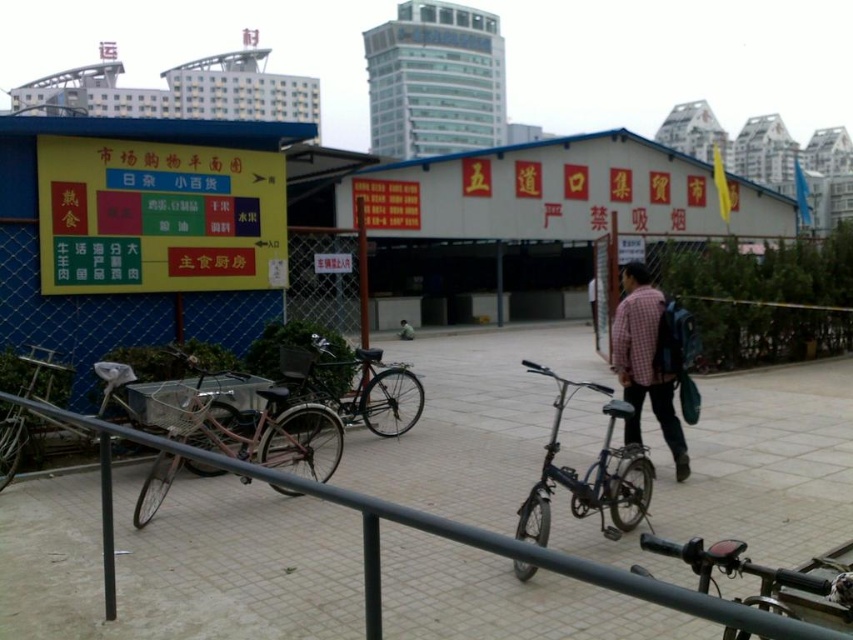
Question: Which is nearer to the plaid shirt at center?

Choices:
 (A) shiny black bicycle at center
 (B) pink matte bicycle at center-left
 (C) gray concrete pavement at center
 (D) blue metallic bicycle at center

Answer: (D)

Question: Can you confirm if gray concrete pavement at center is positioned below plaid shirt at center?

Choices:
 (A) yes
 (B) no

Answer: (A)

Question: Can you confirm if blue metallic bicycle at center is wider than shiny black bicycle at center?

Choices:
 (A) yes
 (B) no

Answer: (B)

Question: Does gray concrete pavement at center appear on the left side of plaid shirt at center?

Choices:
 (A) yes
 (B) no

Answer: (B)

Question: Which of the following is the farthest from the observer?

Choices:
 (A) (x=654, y=324)
 (B) (x=260, y=417)
 (C) (x=344, y=406)

Answer: (C)

Question: Which point is closer to the camera?

Choices:
 (A) blue metallic bicycle at center
 (B) pink matte bicycle at center-left
 (C) plaid shirt at center
 (D) gray concrete pavement at center

Answer: (D)